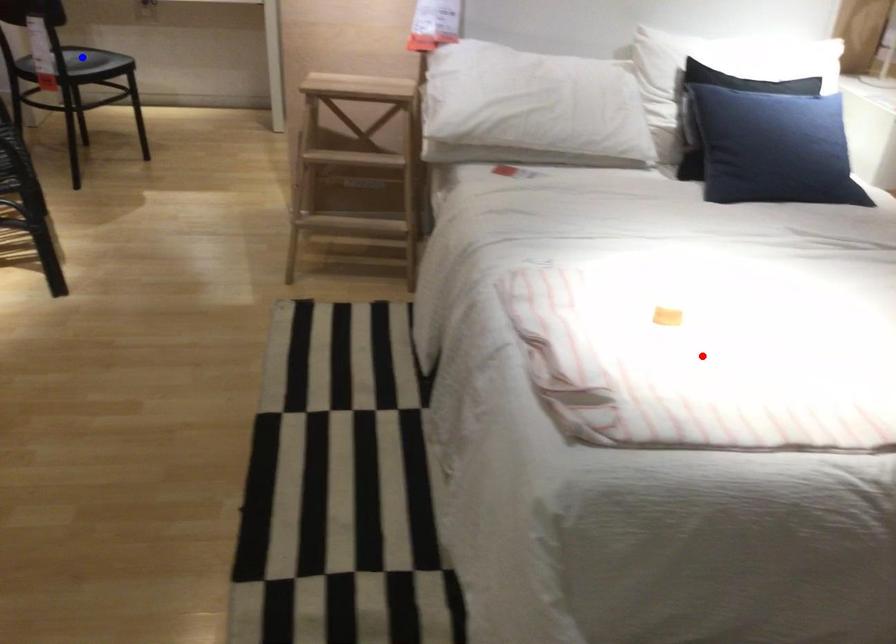
Question: In the image, two points are highlighted. Which point is nearer to the camera? Reply with the corresponding letter.

Choices:
 (A) blue point
 (B) red point

Answer: (B)